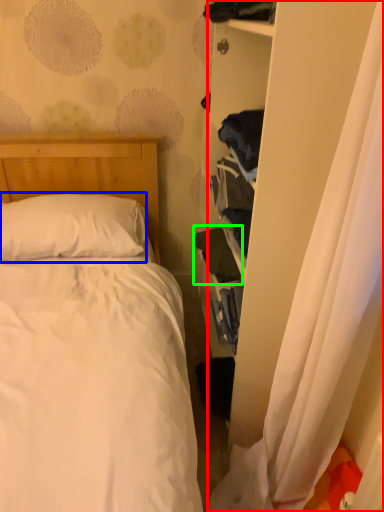
Question: Considering the real-world distances, which object is closest to curtain (highlighted by a red box)? pillow (highlighted by a blue box) or clothing (highlighted by a green box).

Choices:
 (A) pillow
 (B) clothing

Answer: (B)